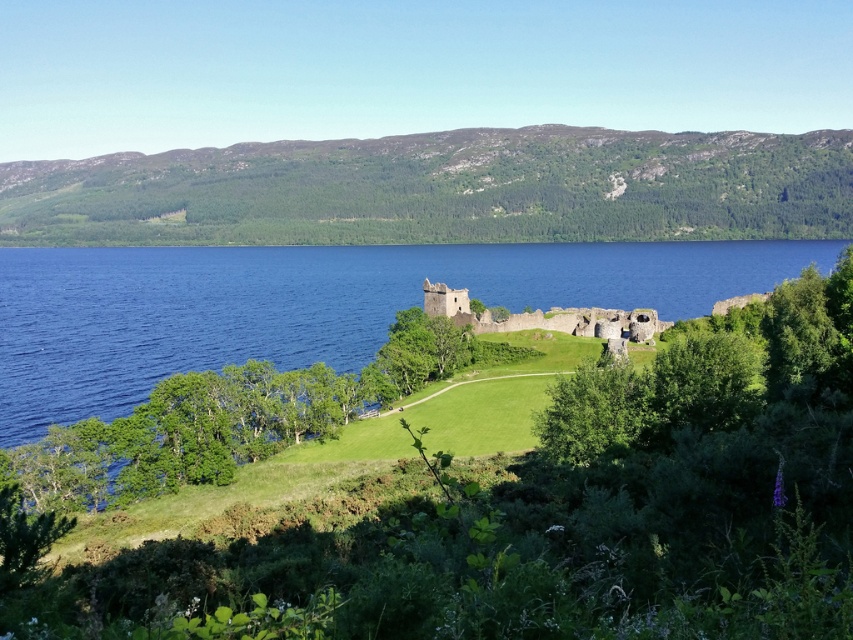
You are a hiker standing at the base of the green grassy hillside at upper center and want to reach the stone ruins at center. Which direction should you walk to get there?

You should walk to the right because the green grassy hillside at upper center is located to the left of the stone ruins at center, so moving right will lead you towards the stone ruins at center.

You are standing at the point labeled point (x=306, y=305) in the image. What is the closest object to you in the scene?

The closest object to you is the blue water at center, as the point (x=306, y=305) represents its location.

You are a hiker standing at the bottom of the hill. You want to reach the green grassy hillside at upper center. Which direction should you move?

You should move towards the upper center direction to reach the green grassy hillside at upper center.